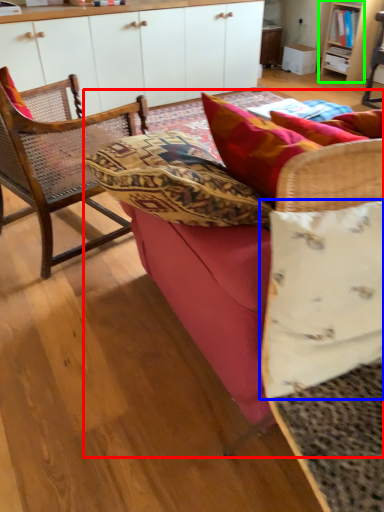
Question: Which object is the farthest from studio couch (highlighted by a red box)? Choose among these: pillow (highlighted by a blue box) or shelf (highlighted by a green box).

Choices:
 (A) pillow
 (B) shelf

Answer: (B)